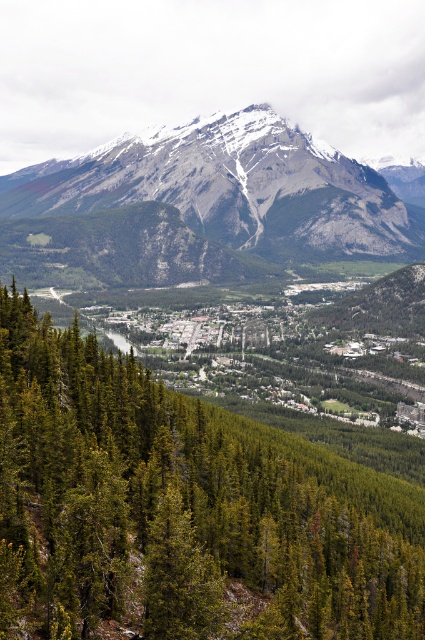
You are an aerial photographer planning to capture the green matte tree at center and the snowy granite mountain range at upper center in a single shot. Based on their positions, which object will appear larger in the photo?

The green matte tree at center will appear larger in the photo because it is closer to the viewer than the snowy granite mountain range at upper center.

Looking at this image, you are an aerial photographer planning to capture the green matte tree at center and the snowy granite mountain range at upper center in a single shot. Based on their positions, which object should you adjust your camera to focus on first to ensure both are in frame?

The green matte tree at center is to the right of the snowy granite mountain range at upper center, so you should focus on the snowy granite mountain range at upper center first to ensure both are in frame.